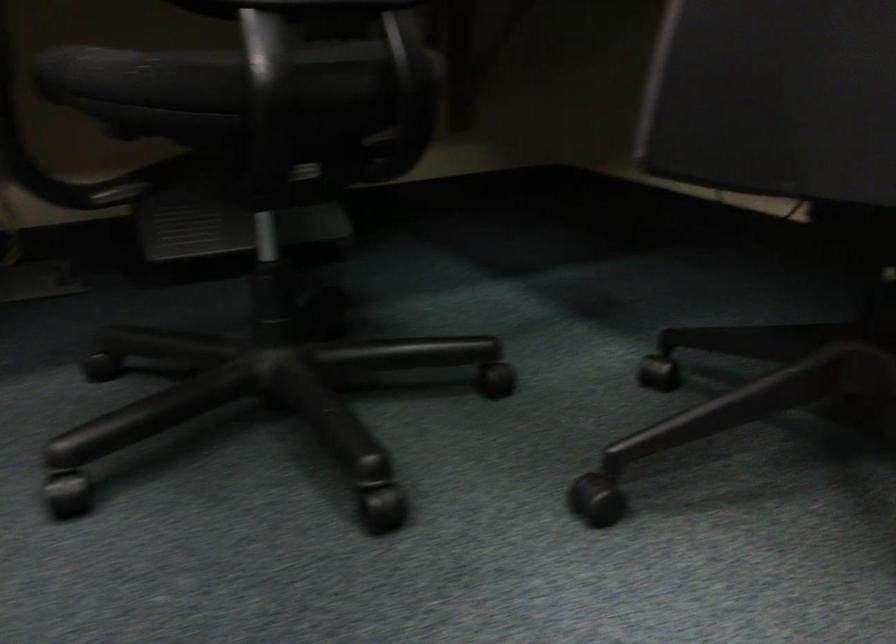
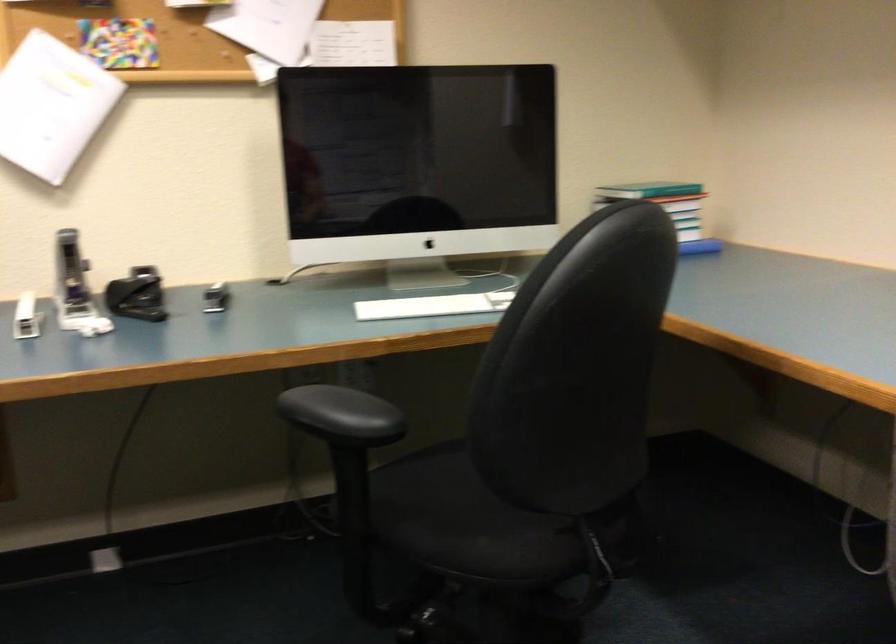
Question: The first image is from the beginning of the video and the second image is from the end. How did the camera likely rotate when shooting the video?

Choices:
 (A) Left
 (B) Right
 (C) Up
 (D) Down

Answer: (B)